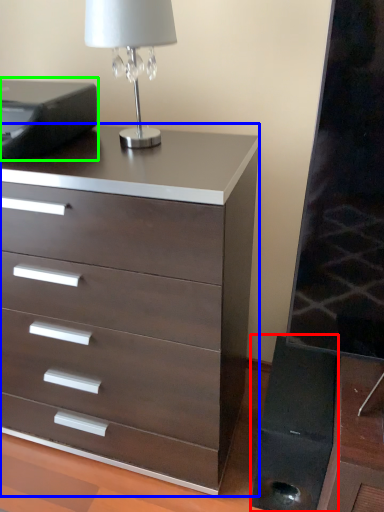
Question: Which object is positioned farthest from speaker (highlighted by a red box)? Select from chest of drawers (highlighted by a blue box) and printer (highlighted by a green box).

Choices:
 (A) chest of drawers
 (B) printer

Answer: (B)